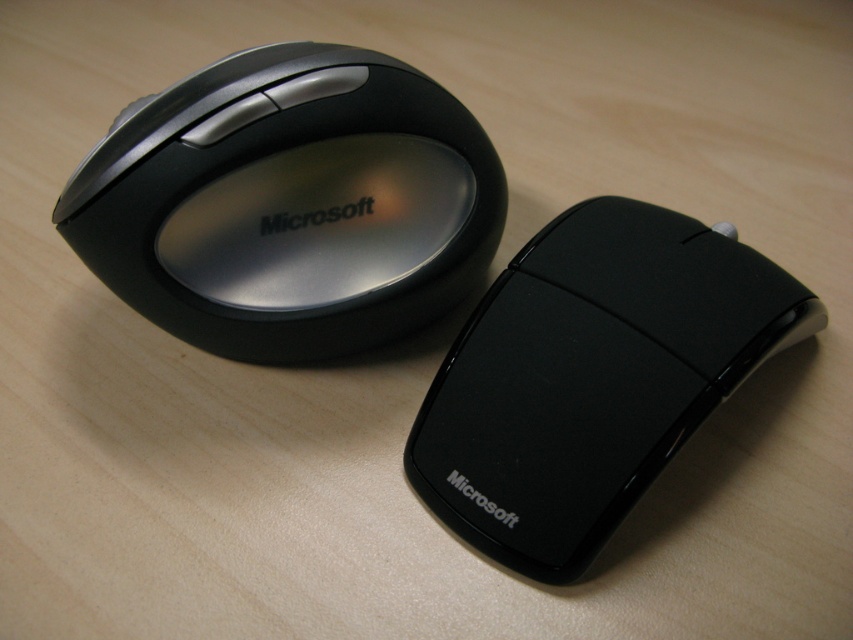
Does satin black mouse at upper left have a smaller size compared to black glossy mouse at center?

Actually, satin black mouse at upper left might be larger than black glossy mouse at center.

This screenshot has width=853, height=640. What do you see at coordinates (289, 204) in the screenshot?
I see `satin black mouse at upper left` at bounding box center [289, 204].

Is point (381, 253) behind point (566, 422)?

Yes, it is.

The image size is (853, 640). What are the coordinates of `satin black mouse at upper left` in the screenshot? It's located at (289, 204).